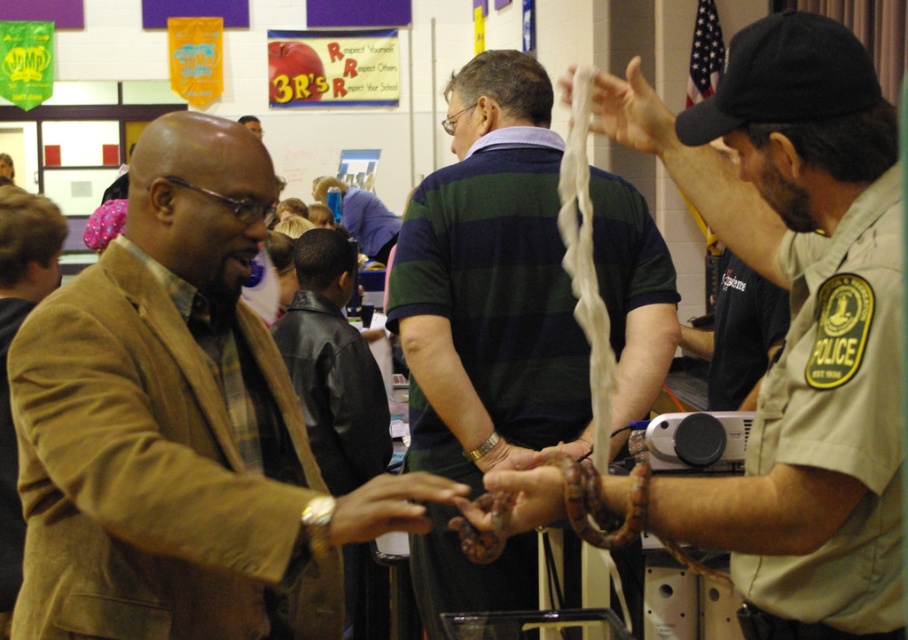
Who is taller, brown woolen jacket at left or silver metallic bracelet at center?

Standing taller between the two is brown woolen jacket at left.

Can you confirm if brown woolen jacket at left is positioned above silver metallic bracelet at center?

Correct, brown woolen jacket at left is located above silver metallic bracelet at center.

Is point (3, 504) farther from viewer compared to point (482, 442)?

That is True.

Image resolution: width=908 pixels, height=640 pixels. Find the location of `brown woolen jacket at left`. brown woolen jacket at left is located at coordinates (7, 349).

Is green striped shirt at center further to camera compared to brown woolen jacket at left?

No, green striped shirt at center is in front of brown woolen jacket at left.

Is green striped shirt at center positioned in front of brown woolen jacket at left?

Yes, it is.

Who is more forward, (601, 272) or (15, 484)?

Point (15, 484) is more forward.

Find the location of a particular element. This screenshot has height=640, width=908. green striped shirt at center is located at coordinates (490, 285).

Is brown leather jacket at left to the right of smooth brown snake at center from the viewer's perspective?

No, brown leather jacket at left is not to the right of smooth brown snake at center.

Who is lower down, brown leather jacket at left or smooth brown snake at center?

brown leather jacket at left

The image size is (908, 640). What do you see at coordinates (180, 426) in the screenshot?
I see `brown leather jacket at left` at bounding box center [180, 426].

Identify the location of brown leather jacket at left. (180, 426).